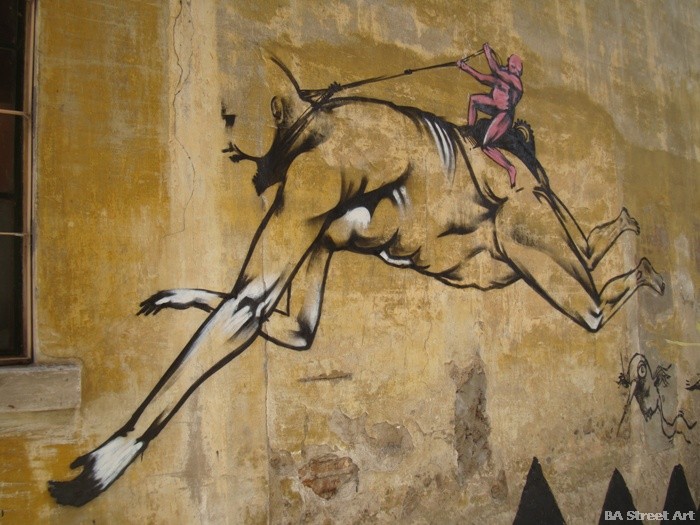
Where is `art`? art is located at coordinates (218, 357).